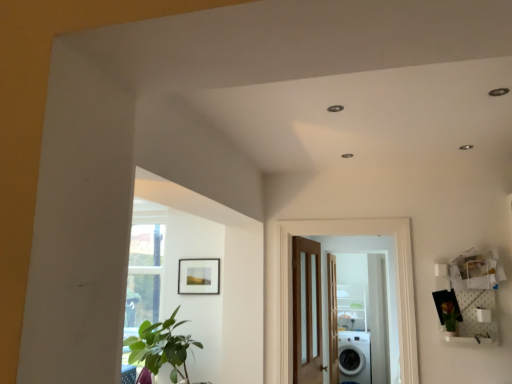
Question: Is the depth of wooden door at center, the 3th door when ordered from front to back, less than that of brown wooden door at center, the 1th door positioned from the front?

Choices:
 (A) yes
 (B) no

Answer: (B)

Question: Is wooden door at center, the 3th door when ordered from front to back, shorter than brown wooden door at center, the third door viewed from the back?

Choices:
 (A) yes
 (B) no

Answer: (B)

Question: From a real-world perspective, is wooden door at center, the 3th door when ordered from front to back, under brown wooden door at center, the 1th door positioned from the front?

Choices:
 (A) no
 (B) yes

Answer: (B)

Question: Does wooden door at center, the 3th door when ordered from front to back, have a smaller size compared to brown wooden door at center, the third door viewed from the back?

Choices:
 (A) yes
 (B) no

Answer: (B)

Question: From the image's perspective, is wooden door at center, marked as the first door in a back-to-front arrangement, located above or below matte wooden picture frame at upper center?

Choices:
 (A) below
 (B) above

Answer: (A)

Question: In terms of width, does wooden door at center, marked as the first door in a back-to-front arrangement, look wider or thinner when compared to matte wooden picture frame at upper center?

Choices:
 (A) thin
 (B) wide

Answer: (B)

Question: Is wooden door at center, marked as the first door in a back-to-front arrangement, situated inside matte wooden picture frame at upper center or outside?

Choices:
 (A) inside
 (B) outside

Answer: (B)

Question: Considering the positions of wooden door at center, the 3th door when ordered from front to back, and matte wooden picture frame at upper center in the image, is wooden door at center, the 3th door when ordered from front to back, bigger or smaller than matte wooden picture frame at upper center?

Choices:
 (A) big
 (B) small

Answer: (A)

Question: Is brown wooden door at center, the 1th door positioned from the front, taller or shorter than wooden door with glass panels at center, acting as the 2th door starting from the front?

Choices:
 (A) tall
 (B) short

Answer: (B)

Question: From a real-world perspective, is brown wooden door at center, the third door viewed from the back, above or below wooden door with glass panels at center, acting as the 2th door starting from the front?

Choices:
 (A) above
 (B) below

Answer: (A)

Question: Is brown wooden door at center, the third door viewed from the back, situated inside wooden door with glass panels at center, which is the second door from back to front, or outside?

Choices:
 (A) outside
 (B) inside

Answer: (A)

Question: Is brown wooden door at center, the 1th door positioned from the front, wider or thinner than wooden door with glass panels at center, which is the second door from back to front?

Choices:
 (A) thin
 (B) wide

Answer: (A)

Question: Is white glossy washing machine at lower right inside the boundaries of green leafy plant at right, or outside?

Choices:
 (A) inside
 (B) outside

Answer: (B)

Question: Is point (342, 332) positioned closer to the camera than point (452, 314)?

Choices:
 (A) farther
 (B) closer

Answer: (A)